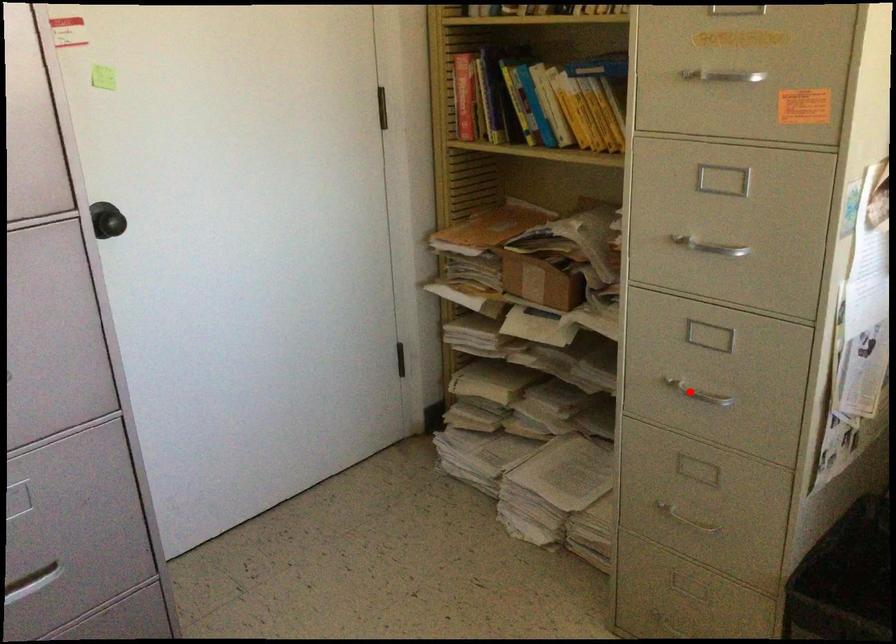
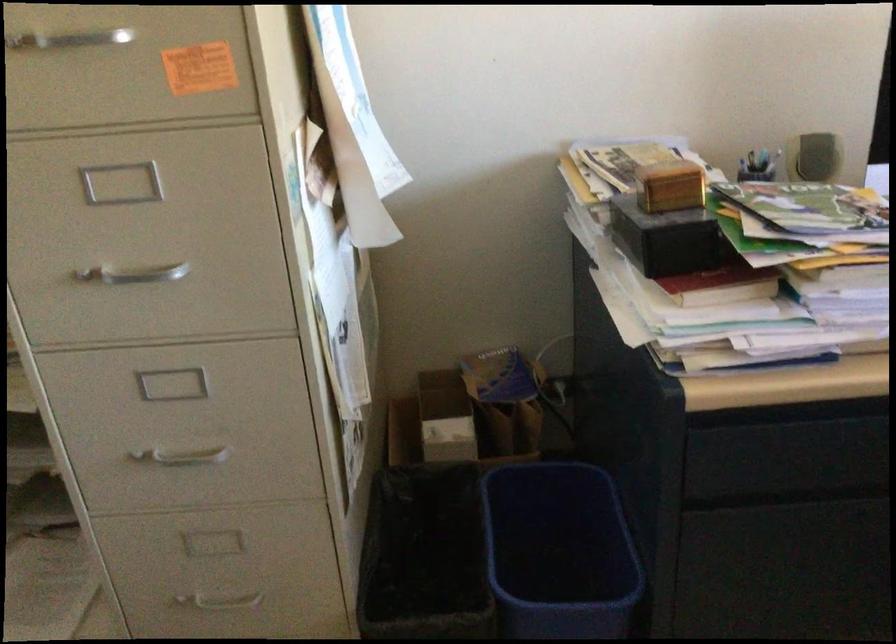
Question: I am providing you with two images of the same scene from different viewpoints. Given a red point in image1, look at the same physical point in image2. Is it:

Choices:
 (A) Closer to the viewpoint
 (B) Farther from the viewpoint

Answer: (A)